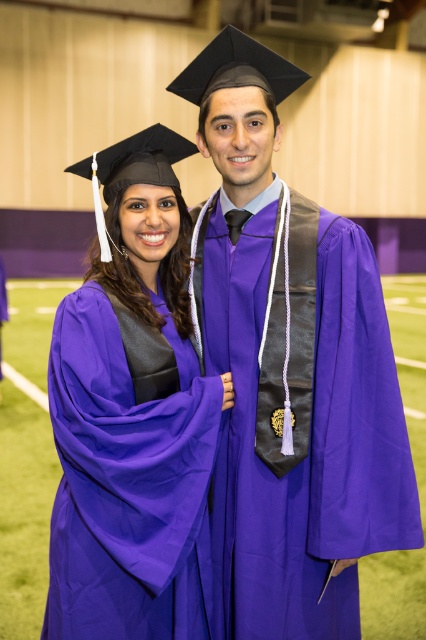
In the scene shown: Is purple matte graduation gown at center smaller than purple matte graduation gown at left?

Incorrect, purple matte graduation gown at center is not smaller in size than purple matte graduation gown at left.

Can you confirm if purple matte graduation gown at center is positioned to the left of purple matte graduation gown at left?

No, purple matte graduation gown at center is not to the left of purple matte graduation gown at left.

Which is behind, point (319, 394) or point (55, 324)?

The point (319, 394) is behind.

Locate an element on the screen. The width and height of the screenshot is (426, 640). purple matte graduation gown at center is located at coordinates (290, 371).